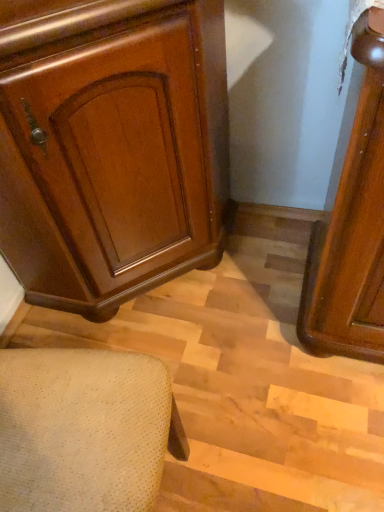
What do you see at coordinates (117, 159) in the screenshot? This screenshot has width=384, height=512. I see `shiny brown wood cupboard at left` at bounding box center [117, 159].

Image resolution: width=384 pixels, height=512 pixels. I want to click on shiny brown wood cupboard at left, so click(117, 159).

I want to click on shiny brown wood cupboard at left, so click(x=117, y=159).